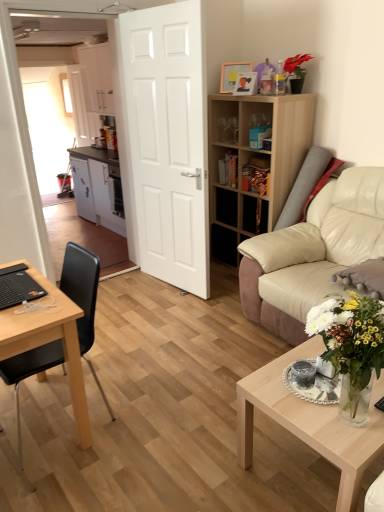
Question: Is white glossy vase at lower right not inside white matte cabinet at left, the 2th cabinetry in the top-to-bottom sequence?

Choices:
 (A) no
 (B) yes

Answer: (B)

Question: Is white glossy vase at lower right turned away from white matte cabinet at left, acting as the 1th cabinetry starting from the bottom?

Choices:
 (A) yes
 (B) no

Answer: (B)

Question: Is white glossy vase at lower right to the right of white matte cabinet at left, acting as the 1th cabinetry starting from the bottom, from the viewer's perspective?

Choices:
 (A) no
 (B) yes

Answer: (B)

Question: Considering the relative sizes of white glossy vase at lower right and white matte cabinet at left, the 2th cabinetry in the top-to-bottom sequence, in the image provided, is white glossy vase at lower right smaller than white matte cabinet at left, the 2th cabinetry in the top-to-bottom sequence,?

Choices:
 (A) no
 (B) yes

Answer: (B)

Question: Is white glossy vase at lower right positioned in front of white matte cabinet at left, the 2th cabinetry in the top-to-bottom sequence?

Choices:
 (A) no
 (B) yes

Answer: (B)

Question: Choose the correct answer: Is beige leather couch at right inside wooden bookshelf at right or outside it?

Choices:
 (A) outside
 (B) inside

Answer: (A)

Question: Is beige leather couch at right bigger or smaller than wooden bookshelf at right?

Choices:
 (A) big
 (B) small

Answer: (A)

Question: Relative to wooden bookshelf at right, is beige leather couch at right in front or behind?

Choices:
 (A) front
 (B) behind

Answer: (A)

Question: Does point (344, 253) appear closer or farther from the camera than point (213, 120)?

Choices:
 (A) closer
 (B) farther

Answer: (A)

Question: Considering the positions of wooden picture frame at upper center, marked as the second picture frame in a front-to-back arrangement, and wooden picture frame at upper center, the second picture frame when ordered from back to front, in the image, is wooden picture frame at upper center, marked as the second picture frame in a front-to-back arrangement, bigger or smaller than wooden picture frame at upper center, the second picture frame when ordered from back to front,?

Choices:
 (A) small
 (B) big

Answer: (B)

Question: From a real-world perspective, relative to wooden picture frame at upper center, the second picture frame when ordered from back to front, is wooden picture frame at upper center, which is the first picture frame in back-to-front order, vertically above or below?

Choices:
 (A) below
 (B) above

Answer: (B)

Question: Is point (230, 62) positioned closer to the camera than point (246, 82)?

Choices:
 (A) closer
 (B) farther

Answer: (B)

Question: From the image's perspective, is wooden picture frame at upper center, marked as the second picture frame in a front-to-back arrangement, located above or below wooden picture frame at upper center, the second picture frame when ordered from back to front?

Choices:
 (A) above
 (B) below

Answer: (A)

Question: Is white matte cabinet at left, acting as the 1th cabinetry starting from the bottom, taller or shorter than wooden bookshelf at right?

Choices:
 (A) short
 (B) tall

Answer: (A)

Question: From a real-world perspective, is white matte cabinet at left, the 2th cabinetry in the top-to-bottom sequence, physically located above or below wooden bookshelf at right?

Choices:
 (A) above
 (B) below

Answer: (B)